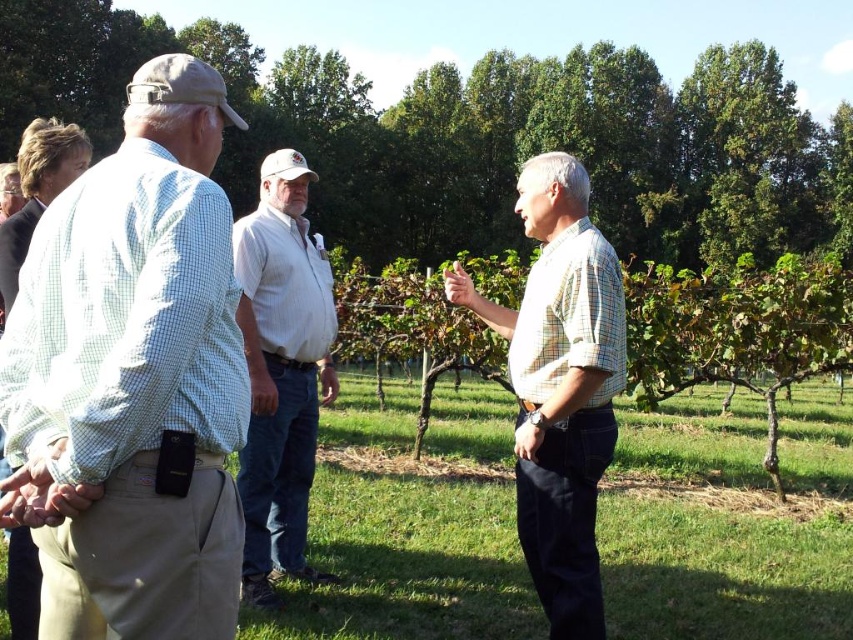
Question: Is yellow-green checkered shirt at center smaller than white striped shirt at center?

Choices:
 (A) yes
 (B) no

Answer: (B)

Question: Can you confirm if yellow-green checkered shirt at center is smaller than green checkered shirt at left?

Choices:
 (A) yes
 (B) no

Answer: (A)

Question: Which point appears farthest from the camera in this image?

Choices:
 (A) (146, 397)
 (B) (540, 410)
 (C) (294, 360)
 (D) (16, 588)

Answer: (C)

Question: Which object appears farthest from the camera in this image?

Choices:
 (A) white striped shirt at center
 (B) light green checkered shirt at left

Answer: (A)

Question: Which point is farther to the camera?

Choices:
 (A) (305, 454)
 (B) (511, 312)
 (C) (36, 484)

Answer: (A)

Question: Can you confirm if yellow-green checkered shirt at center is positioned to the right of white striped shirt at center?

Choices:
 (A) yes
 (B) no

Answer: (A)